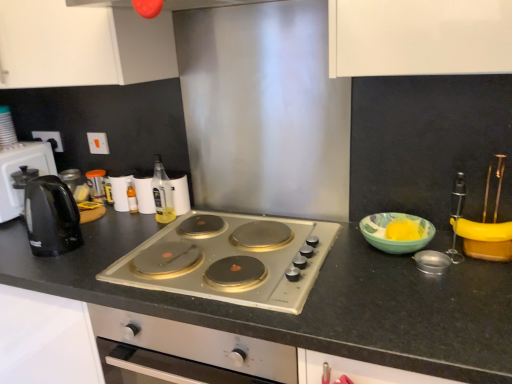
This screenshot has height=384, width=512. What are the coordinates of `free space to the left of translucent glass bottle at center, which is the 1th bottle from front to back` in the screenshot? It's located at (122, 222).